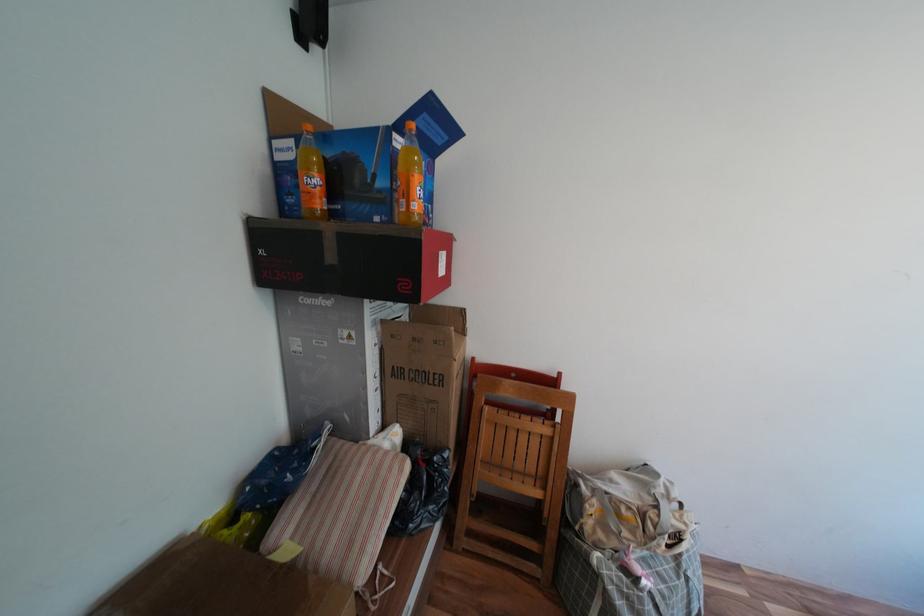
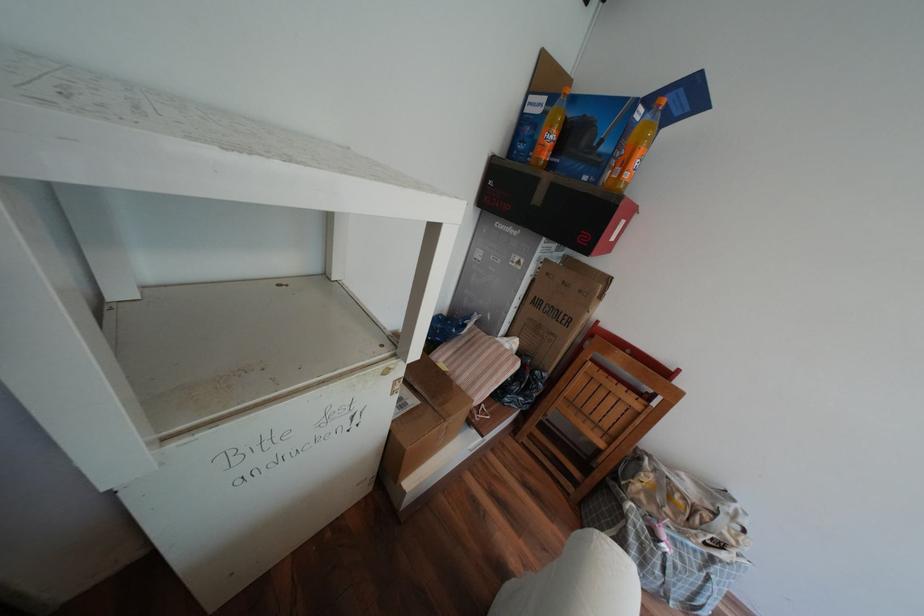
Where in the second image is the point corresponding to point 327,235 from the first image?

(545, 180)